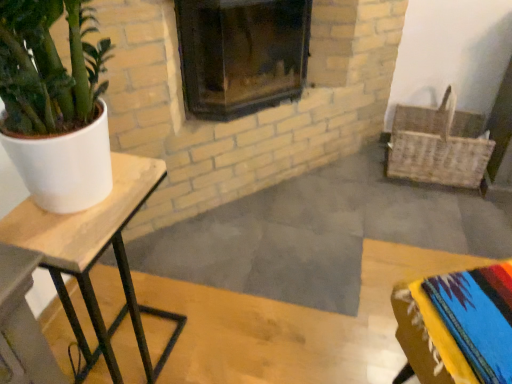
What are the coordinates of `wooden table at left` in the screenshot? It's located at (96, 256).

Measure the distance between wooden table at left and camera.

wooden table at left and camera are 31.97 inches apart from each other.

Identify the location of wooden table at left. (96, 256).

From a real-world perspective, is wooden table at left positioned over dark glass fireplace at center based on gravity?

No, from a real-world perspective, wooden table at left is not over dark glass fireplace at center

Can dark glass fireplace at center be found inside wooden table at left?

No, dark glass fireplace at center is not surrounded by wooden table at left.

Does wooden table at left have a smaller size compared to dark glass fireplace at center?

Yes, wooden table at left is smaller than dark glass fireplace at center.

In order to click on basket that is on the right side of wooden table at left in this screenshot , I will do `click(439, 145)`.

Is woven wicker basket at right at the back of wooden table at left?

No.

Which object is positioned more to the left, wooden table at left or woven wicker basket at right?

Positioned to the left is wooden table at left.

Which object is wider, wooden table at left or woven wicker basket at right?

Wider between the two is woven wicker basket at right.

What's the angular difference between woven wicker basket at right and dark glass fireplace at center's facing directions?

woven wicker basket at right and dark glass fireplace at center are facing 47.6 degrees away from each other.

Consider the image. Is dark glass fireplace at center completely or partially inside woven wicker basket at right?

Definitely not — dark glass fireplace at center is not inside woven wicker basket at right.

Is woven wicker basket at right looking in the opposite direction of dark glass fireplace at center?

No, woven wicker basket at right is not facing away from dark glass fireplace at center.

You are a GUI agent. You are given a task and a screenshot of the screen. Output one action in this format:
    pyautogui.click(x=<x>, y=<y>)
    Task: Click on the fireplace lying on the left of woven wicker basket at right
    
    Given the screenshot: What is the action you would take?
    pyautogui.click(x=241, y=55)

Looking at this image, is dark glass fireplace at center taller than wooden table at left?

No, dark glass fireplace at center is not taller than wooden table at left.

Locate an element on the screen. Image resolution: width=512 pixels, height=384 pixels. table in front of the dark glass fireplace at center is located at coordinates (96, 256).

In terms of size, does dark glass fireplace at center appear bigger or smaller than wooden table at left?

Clearly, dark glass fireplace at center is larger in size than wooden table at left.

Does dark glass fireplace at center have a greater width compared to wooden table at left?

Yes, dark glass fireplace at center is wider than wooden table at left.

Is woven wicker basket at right taller or shorter than wooden table at left?

Considering their sizes, woven wicker basket at right has less height than wooden table at left.

Does woven wicker basket at right appear on the right side of wooden table at left?

Yes, woven wicker basket at right is to the right of wooden table at left.

Where is `basket above the wooden table at left (from the image's perspective)`? The width and height of the screenshot is (512, 384). basket above the wooden table at left (from the image's perspective) is located at coordinates click(x=439, y=145).

Considering the points (410, 138) and (159, 174), which point is behind, point (410, 138) or point (159, 174)?

The point (410, 138) is more distant.

Is dark glass fireplace at center positioned beyond the bounds of woven wicker basket at right?

Yes, dark glass fireplace at center is not within woven wicker basket at right.

Are dark glass fireplace at center and woven wicker basket at right making contact?

There is a gap between dark glass fireplace at center and woven wicker basket at right.

Could you tell me if dark glass fireplace at center is turned towards woven wicker basket at right?

No, dark glass fireplace at center is not facing towards woven wicker basket at right.

Would you say dark glass fireplace at center is to the left or to the right of woven wicker basket at right in the picture?

Based on their positions, dark glass fireplace at center is located to the left of woven wicker basket at right.

The image size is (512, 384). There is a wooden table at left. Find the location of `fireplace above it (from a real-world perspective)`. fireplace above it (from a real-world perspective) is located at coordinates (241, 55).

Locate an element on the screen. basket located on the right of wooden table at left is located at coordinates (439, 145).

Estimate the real-world distances between objects in this image. Which object is closer to woven wicker basket at right, dark glass fireplace at center or wooden table at left?

dark glass fireplace at center lies closer to woven wicker basket at right than the other object.

Based on their spatial positions, is woven wicker basket at right or dark glass fireplace at center further from wooden table at left?

Among the two, woven wicker basket at right is located further to wooden table at left.

Looking at the image, which one is located further to dark glass fireplace at center, wooden table at left or woven wicker basket at right?

The object further to dark glass fireplace at center is wooden table at left.

Looking at the image, which one is located closer to dark glass fireplace at center, woven wicker basket at right or wooden table at left?

Based on the image, woven wicker basket at right appears to be nearer to dark glass fireplace at center.

From the image, which object appears to be farther from wooden table at left, dark glass fireplace at center or woven wicker basket at right?

The object further to wooden table at left is woven wicker basket at right.

Which object lies further to the anchor point woven wicker basket at right, wooden table at left or dark glass fireplace at center?

wooden table at left is further to woven wicker basket at right.

Find the location of a particular element. The height and width of the screenshot is (384, 512). fireplace between wooden table at left and woven wicker basket at right in the horizontal direction is located at coordinates (241, 55).